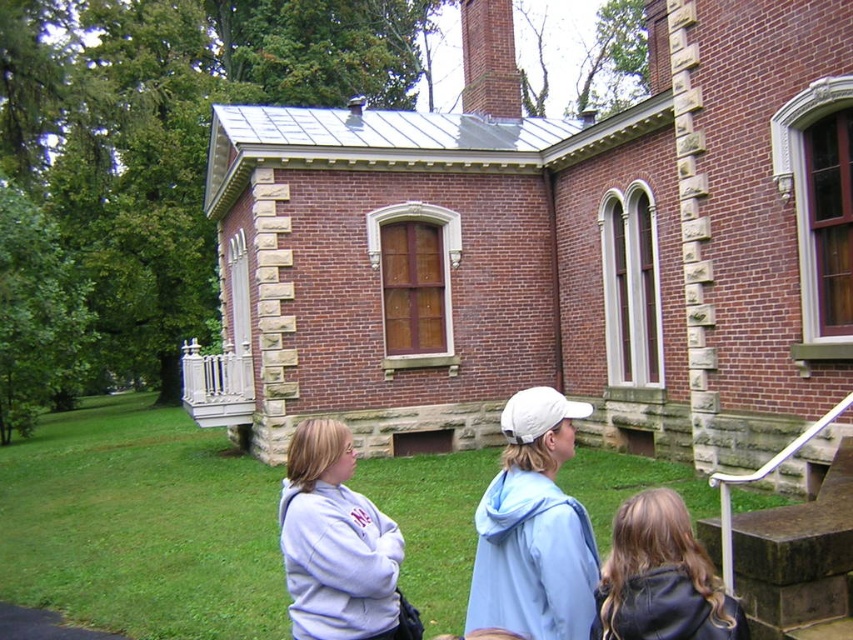
Question: Which object is the farthest from the light purple fleece at center?

Choices:
 (A) green grass at lower center
 (B) dark brown leather jacket at lower right

Answer: (A)

Question: Can you confirm if white matte baseball cap at center is positioned to the left of light purple fleece at center?

Choices:
 (A) yes
 (B) no

Answer: (B)

Question: Is green grass at lower center smaller than white matte baseball cap at center?

Choices:
 (A) no
 (B) yes

Answer: (A)

Question: Considering the relative positions of green grass at lower center and dark brown leather jacket at lower right in the image provided, where is green grass at lower center located with respect to dark brown leather jacket at lower right?

Choices:
 (A) above
 (B) below

Answer: (B)

Question: Which point is closer to the camera taking this photo?

Choices:
 (A) (132, 588)
 (B) (352, 634)
 (C) (525, 456)

Answer: (C)

Question: Among these objects, which one is nearest to the camera?

Choices:
 (A) light purple fleece at center
 (B) green grass at lower center
 (C) dark brown leather jacket at lower right

Answer: (C)